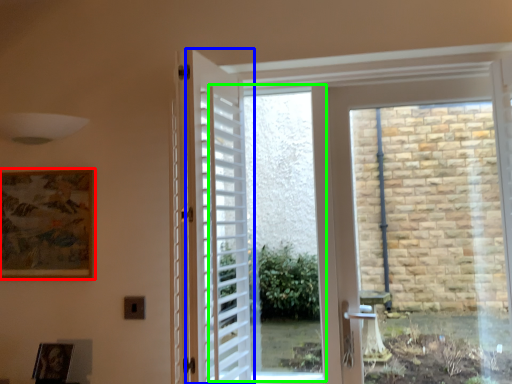
Question: Which object is the closest to the picture frame (highlighted by a red box)? Choose among these: door (highlighted by a blue box) or window screen (highlighted by a green box).

Choices:
 (A) door
 (B) window screen

Answer: (A)